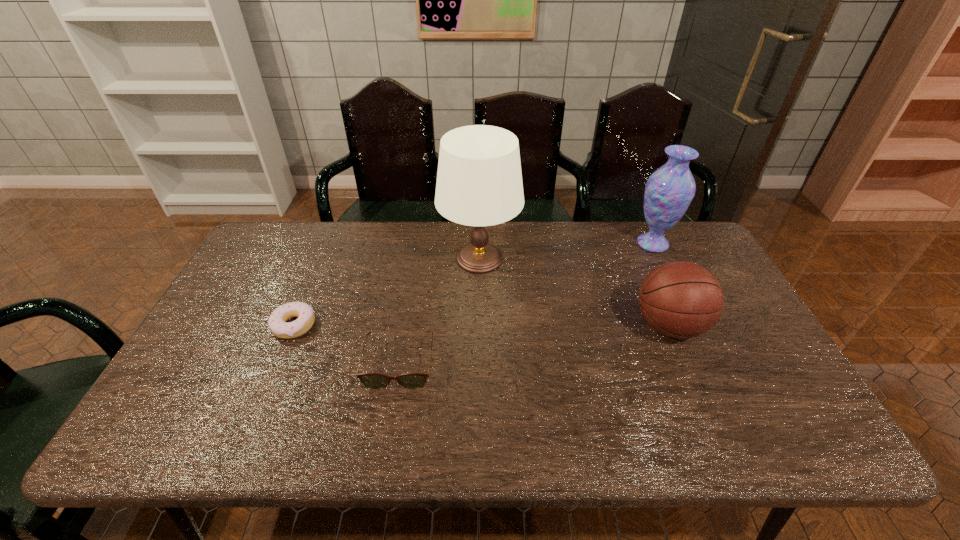
At what (x,y) coordinates should I click in order to perform the action: click on lamp. Please return your answer as a coordinate pair (x, y). The width and height of the screenshot is (960, 540). Looking at the image, I should click on click(479, 183).

Locate an element on the screen. vase is located at coordinates (669, 190).

Where is `the third shortest object`? the third shortest object is located at coordinates (680, 299).

Where is `the fourth tallest object`? the fourth tallest object is located at coordinates (370, 380).

Find the location of a particular element. The image size is (960, 540). doughnut is located at coordinates (277, 323).

Find the location of a particular element. Image resolution: width=960 pixels, height=540 pixels. the shortest object is located at coordinates (277, 323).

Locate an element on the screen. free space located 0.190m on the front of the lamp is located at coordinates (479, 334).

The width and height of the screenshot is (960, 540). In order to click on free region located on the left of the vase in this screenshot , I will do `click(587, 244)`.

This screenshot has height=540, width=960. Find the location of `free space located on the left of the third shortest object`. free space located on the left of the third shortest object is located at coordinates [x=614, y=326].

Find the location of `free space located 0.100m at the front view of the spectacles`. free space located 0.100m at the front view of the spectacles is located at coordinates (389, 428).